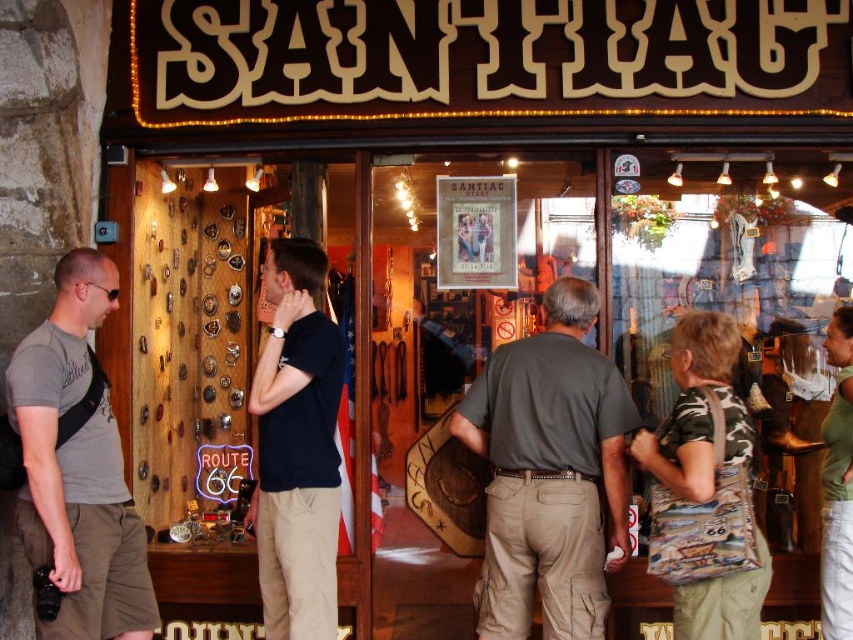
Question: Which of the following is the closest to the observer?

Choices:
 (A) green denim jeans at lower right
 (B) dark blue t-shirt at center

Answer: (B)

Question: Does camouflage fabric bag at lower right have a greater width compared to green denim jeans at lower right?

Choices:
 (A) yes
 (B) no

Answer: (A)

Question: Is the position of khaki cargo pants at center more distant than that of camouflage fabric bag at lower right?

Choices:
 (A) yes
 (B) no

Answer: (A)

Question: Which point appears farthest from the camera in this image?

Choices:
 (A) (281, 349)
 (B) (49, 392)

Answer: (A)

Question: Where is dark blue t-shirt at center located in relation to camouflage fabric bag at lower right in the image?

Choices:
 (A) above
 (B) below

Answer: (A)

Question: Estimate the real-world distances between objects in this image. Which object is closer to the green denim jeans at lower right?

Choices:
 (A) khaki cargo pants at center
 (B) dark blue t-shirt at center

Answer: (A)